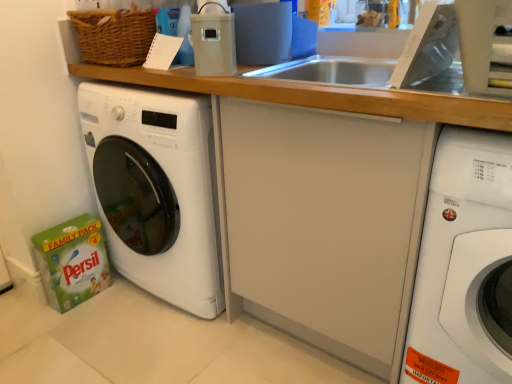
Image resolution: width=512 pixels, height=384 pixels. I want to click on matte plastic container at upper center, so click(x=213, y=40).

You are a GUI agent. You are given a task and a screenshot of the screen. Output one action in this format:
    pyautogui.click(x=<x>, y=<y>)
    Task: Click on the white glossy washing machine at left, which is the first washing machine in left-to-right order
    
    Given the screenshot: What is the action you would take?
    [156, 190]

The height and width of the screenshot is (384, 512). Describe the element at coordinates (464, 265) in the screenshot. I see `white glossy washing machine at right, acting as the 2th washing machine starting from the left` at that location.

The height and width of the screenshot is (384, 512). I want to click on matte plastic container at upper center, so click(x=213, y=40).

Which object is further away from the camera, matte plastic container at upper center or white glossy washing machine at left, the second washing machine when ordered from right to left?

white glossy washing machine at left, the second washing machine when ordered from right to left, is further from the camera.

Are matte plastic container at upper center and white glossy washing machine at left, the second washing machine when ordered from right to left, beside each other?

No, matte plastic container at upper center is not with white glossy washing machine at left, the second washing machine when ordered from right to left.

Is matte plastic container at upper center looking in the opposite direction of white glossy washing machine at left, which is the first washing machine in left-to-right order?

That's not correct — matte plastic container at upper center is not looking away from white glossy washing machine at left, which is the first washing machine in left-to-right order.

Considering the sizes of objects matte plastic container at upper center and white glossy washing machine at left, which is the first washing machine in left-to-right order, in the image provided, who is thinner, matte plastic container at upper center or white glossy washing machine at left, which is the first washing machine in left-to-right order,?

matte plastic container at upper center.

Which of these two, white glossy washing machine at left, the second washing machine when ordered from right to left, or white glossy washing machine at right, positioned as the first washing machine in right-to-left order, is thinner?

Thinner between the two is white glossy washing machine at right, positioned as the first washing machine in right-to-left order.

Is white glossy washing machine at left, which is the first washing machine in left-to-right order, to the left of white glossy washing machine at right, acting as the 2th washing machine starting from the left, from the viewer's perspective?

Yes.

From a real-world perspective, which is physically above, white glossy washing machine at left, the second washing machine when ordered from right to left, or white glossy washing machine at right, positioned as the first washing machine in right-to-left order?

white glossy washing machine at left, the second washing machine when ordered from right to left, is physically above.

Is white glossy washing machine at left, which is the first washing machine in left-to-right order, not near white glossy washing machine at right, positioned as the first washing machine in right-to-left order?

No, there isn't a large distance between white glossy washing machine at left, which is the first washing machine in left-to-right order, and white glossy washing machine at right, positioned as the first washing machine in right-to-left order.

Who is shorter, white glossy washing machine at right, acting as the 2th washing machine starting from the left, or white glossy washing machine at left, which is the first washing machine in left-to-right order?

white glossy washing machine at left, which is the first washing machine in left-to-right order.

Could you tell me if white glossy washing machine at right, positioned as the first washing machine in right-to-left order, is turned towards white glossy washing machine at left, the second washing machine when ordered from right to left?

No, white glossy washing machine at right, positioned as the first washing machine in right-to-left order, is not facing towards white glossy washing machine at left, the second washing machine when ordered from right to left.

Image resolution: width=512 pixels, height=384 pixels. There is a white glossy washing machine at right, acting as the 2th washing machine starting from the left. Identify the location of washing machine above it (from a real-world perspective). (156, 190).

How many degrees apart are the facing directions of white glossy washing machine at left, the second washing machine when ordered from right to left, and matte plastic container at upper center?

The angular difference between white glossy washing machine at left, the second washing machine when ordered from right to left, and matte plastic container at upper center is 29.5 degrees.

Does white glossy washing machine at left, which is the first washing machine in left-to-right order, have a lesser width compared to matte plastic container at upper center?

No.

Based on the photo, measure the distance between white glossy washing machine at left, the second washing machine when ordered from right to left, and matte plastic container at upper center.

white glossy washing machine at left, the second washing machine when ordered from right to left, is 45.47 centimeters away from matte plastic container at upper center.

Who is smaller, white glossy washing machine at left, the second washing machine when ordered from right to left, or matte plastic container at upper center?

With smaller size is matte plastic container at upper center.

Does white glossy washing machine at right, positioned as the first washing machine in right-to-left order, have a lesser height compared to matte plastic container at upper center?

No.

Is white glossy washing machine at right, acting as the 2th washing machine starting from the left, turned away from matte plastic container at upper center?

No, matte plastic container at upper center is not at the back of white glossy washing machine at right, acting as the 2th washing machine starting from the left.

From a real-world perspective, between white glossy washing machine at right, acting as the 2th washing machine starting from the left, and matte plastic container at upper center, who is vertically higher?

matte plastic container at upper center, from a real-world perspective.

Can you confirm if white glossy washing machine at right, positioned as the first washing machine in right-to-left order, is positioned to the right of matte plastic container at upper center?

Yes.

Looking at the image, does matte plastic container at upper center seem bigger or smaller compared to white glossy washing machine at right, acting as the 2th washing machine starting from the left?

Considering their sizes, matte plastic container at upper center takes up less space than white glossy washing machine at right, acting as the 2th washing machine starting from the left.

Looking at their sizes, would you say matte plastic container at upper center is wider or thinner than white glossy washing machine at right, acting as the 2th washing machine starting from the left?

Considering their sizes, matte plastic container at upper center looks slimmer than white glossy washing machine at right, acting as the 2th washing machine starting from the left.

From the image's perspective, is matte plastic container at upper center on top of white glossy washing machine at right, acting as the 2th washing machine starting from the left?

Correct, matte plastic container at upper center appears higher than white glossy washing machine at right, acting as the 2th washing machine starting from the left, in the image.

Based on the photo, considering the sizes of objects matte plastic container at upper center and white glossy washing machine at right, positioned as the first washing machine in right-to-left order, in the image provided, who is shorter, matte plastic container at upper center or white glossy washing machine at right, positioned as the first washing machine in right-to-left order,?

Standing shorter between the two is matte plastic container at upper center.

Identify the location of appliance in front of the white glossy washing machine at left, which is the first washing machine in left-to-right order. The height and width of the screenshot is (384, 512). (213, 40).

The width and height of the screenshot is (512, 384). Find the location of `washing machine located below the white glossy washing machine at left, which is the first washing machine in left-to-right order (from the image's perspective)`. washing machine located below the white glossy washing machine at left, which is the first washing machine in left-to-right order (from the image's perspective) is located at coordinates (464, 265).

Based on their spatial positions, is matte plastic container at upper center or white glossy washing machine at left, the second washing machine when ordered from right to left, further from white glossy washing machine at right, acting as the 2th washing machine starting from the left?

The object further to white glossy washing machine at right, acting as the 2th washing machine starting from the left, is white glossy washing machine at left, the second washing machine when ordered from right to left.

From the image, which object appears to be nearer to white glossy washing machine at right, acting as the 2th washing machine starting from the left, white glossy washing machine at left, the second washing machine when ordered from right to left, or matte plastic container at upper center?

Among the two, matte plastic container at upper center is located nearer to white glossy washing machine at right, acting as the 2th washing machine starting from the left.

When comparing their distances from white glossy washing machine at left, which is the first washing machine in left-to-right order, does matte plastic container at upper center or white glossy washing machine at right, positioned as the first washing machine in right-to-left order, seem further?

white glossy washing machine at right, positioned as the first washing machine in right-to-left order, is further to white glossy washing machine at left, which is the first washing machine in left-to-right order.

Looking at the image, which one is located further to matte plastic container at upper center, white glossy washing machine at right, positioned as the first washing machine in right-to-left order, or white glossy washing machine at left, which is the first washing machine in left-to-right order?

white glossy washing machine at right, positioned as the first washing machine in right-to-left order, is positioned further to the anchor matte plastic container at upper center.

When comparing their distances from matte plastic container at upper center, does white glossy washing machine at left, which is the first washing machine in left-to-right order, or white glossy washing machine at right, acting as the 2th washing machine starting from the left, seem further?

The object further to matte plastic container at upper center is white glossy washing machine at right, acting as the 2th washing machine starting from the left.

From the image, which object appears to be farther from white glossy washing machine at left, which is the first washing machine in left-to-right order, white glossy washing machine at right, acting as the 2th washing machine starting from the left, or matte plastic container at upper center?

white glossy washing machine at right, acting as the 2th washing machine starting from the left, is positioned further to the anchor white glossy washing machine at left, which is the first washing machine in left-to-right order.

At what (x,y) coordinates should I click in order to perform the action: click on appliance located between white glossy washing machine at left, which is the first washing machine in left-to-right order, and white glossy washing machine at right, positioned as the first washing machine in right-to-left order, in the left-right direction. Please return your answer as a coordinate pair (x, y). Looking at the image, I should click on (213, 40).